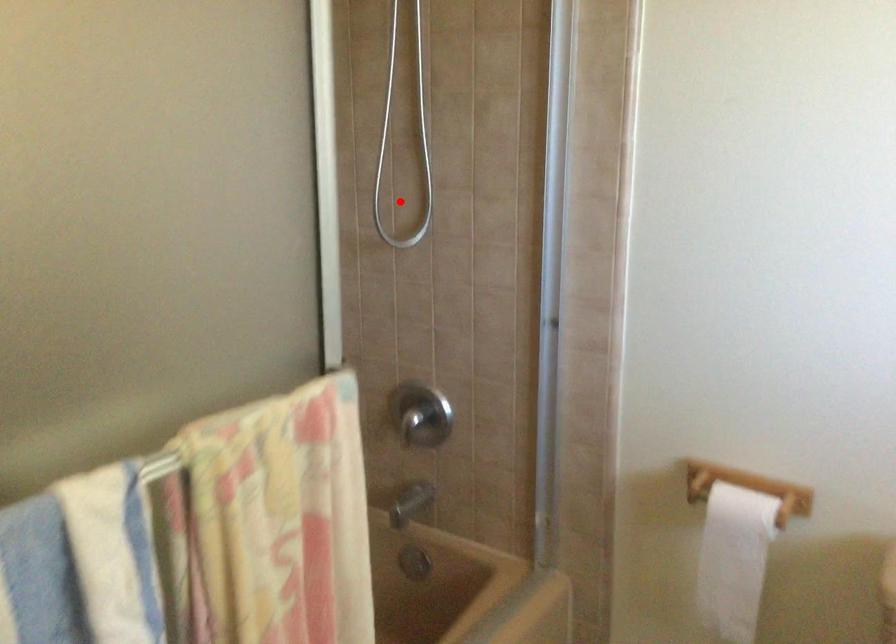
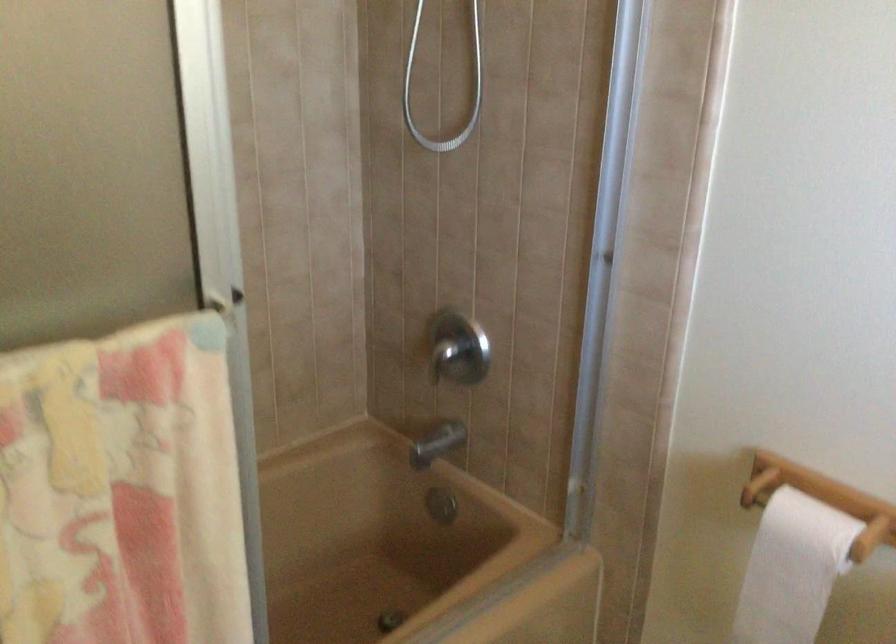
Question: I am providing you with two images of the same scene from different viewpoints. A red point is marked on the first image. Can you still see the location of the red point in image 2?

Choices:
 (A) Yes
 (B) No

Answer: (A)